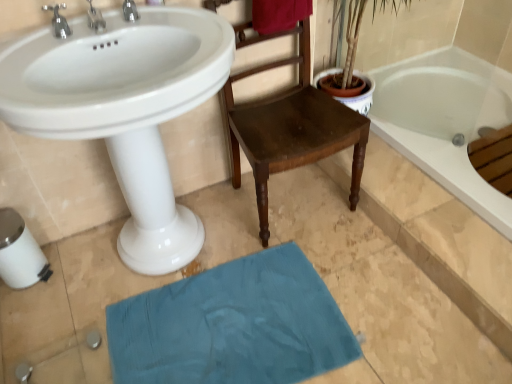
This screenshot has height=384, width=512. In order to click on vacant space that's between silver metallic faucet at upper left, the second tap in the right-to-left sequence, and silver metallic tap at upper left, which is counted as the 3th tap, starting from the left in this screenshot , I will do `click(117, 28)`.